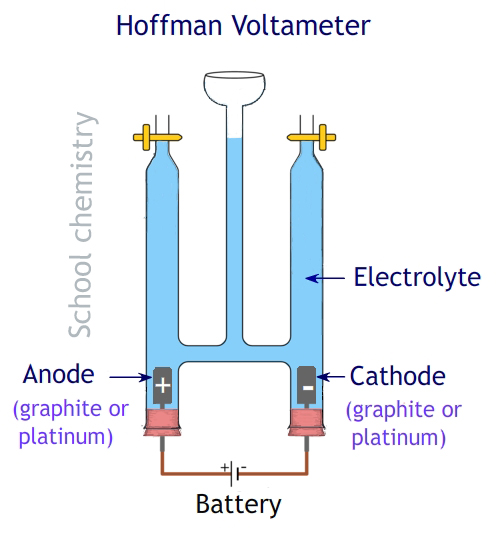
You are a GUI agent. You are given a task and a screenshot of the screen. Output one action in this format:
    pyautogui.click(x=<x>, y=<y>)
    Task: Click on the pink stopper
    
    Given the screenshot: What is the action you would take?
    pyautogui.click(x=168, y=432)